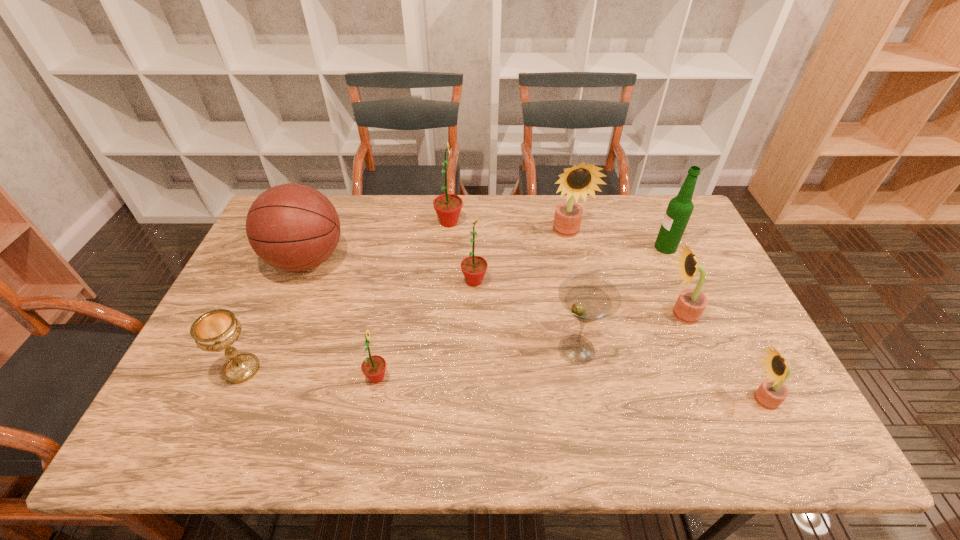
In the image, there is a desktop. Where is `free space at the left edge`? The image size is (960, 540). free space at the left edge is located at coordinates (200, 414).

This screenshot has width=960, height=540. Identify the location of free region at the right edge of the desktop. (753, 414).

I want to click on blank space at the near right corner of the desktop, so click(780, 451).

At what (x,y) coordinates should I click in order to perform the action: click on free space between the second green sunflower from left to right and the chalice. Please return your answer as a coordinate pair (x, y). The image size is (960, 540). Looking at the image, I should click on (346, 296).

Where is `unoccupied area between the martini and the chalice`? This screenshot has width=960, height=540. unoccupied area between the martini and the chalice is located at coordinates (409, 359).

What are the coordinates of `free point between the nearest yellow sunflower and the second farthest yellow sunflower` in the screenshot? It's located at (721, 357).

Where is `free spot between the biggest yellow sunflower and the biggest green sunflower`? free spot between the biggest yellow sunflower and the biggest green sunflower is located at coordinates (508, 228).

This screenshot has width=960, height=540. Identify the location of vacant space in between the biggest green sunflower and the third sunflower from left to right. (462, 252).

The width and height of the screenshot is (960, 540). What are the coordinates of `free space that is in between the fourth object from left to right and the leftmost sunflower` in the screenshot? It's located at (413, 300).

At what (x,y) coordinates should I click in order to perform the action: click on free area in between the second farthest yellow sunflower and the eighth object from right to left. Please return your answer as a coordinate pair (x, y). Looking at the image, I should click on (529, 346).